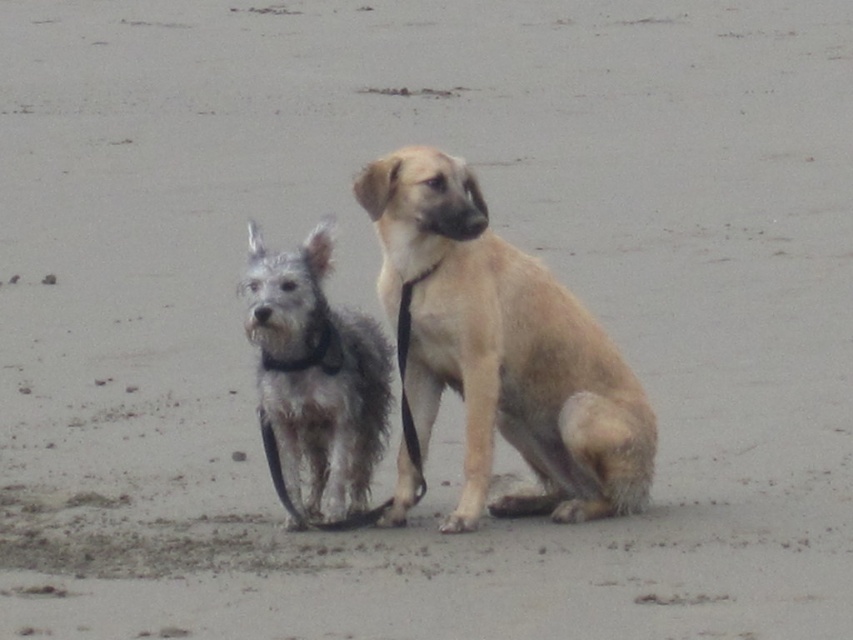
From the picture: Is light brown fur dog at center taller than fuzzy gray dog at center?

Correct, light brown fur dog at center is much taller as fuzzy gray dog at center.

Between light brown fur dog at center and fuzzy gray dog at center, which one is positioned higher?

Positioned higher is fuzzy gray dog at center.

At what (x,y) coordinates should I click in order to perform the action: click on light brown fur dog at center. Please return your answer as a coordinate pair (x, y). This screenshot has width=853, height=640. Looking at the image, I should click on pos(503,349).

Identify the location of light brown fur dog at center. This screenshot has width=853, height=640. (503, 349).